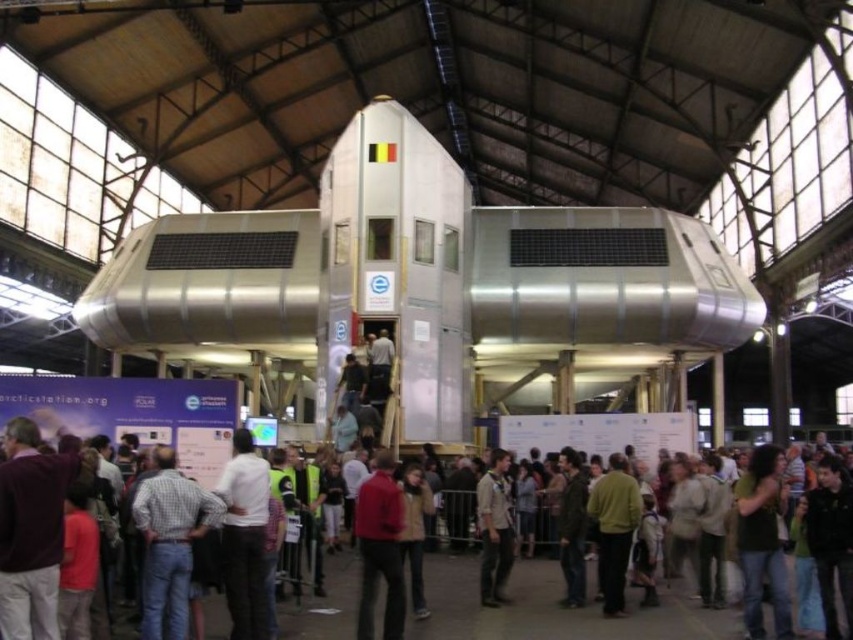
Can you confirm if maroon sweater at lower left is positioned to the left of white matte shirt at center?

Indeed, maroon sweater at lower left is positioned on the left side of white matte shirt at center.

Who is shorter, maroon sweater at lower left or white matte shirt at center?

With less height is maroon sweater at lower left.

Locate an element on the screen. maroon sweater at lower left is located at coordinates (32, 525).

At what (x,y) coordinates should I click in order to perform the action: click on maroon sweater at lower left. Please return your answer as a coordinate pair (x, y). The height and width of the screenshot is (640, 853). Looking at the image, I should click on (32, 525).

What are the coordinates of `checkered shirt jeans at lower left` in the screenshot? It's located at (169, 541).

Who is more distant from viewer, (143, 588) or (227, 547)?

The point (227, 547) is more distant.

In order to click on checkered shirt jeans at lower left in this screenshot , I will do pyautogui.click(x=169, y=541).

Does maroon sweater at lower left appear on the left side of light brown leather jacket at center?

Yes, maroon sweater at lower left is to the left of light brown leather jacket at center.

Can you confirm if maroon sweater at lower left is wider than light brown leather jacket at center?

Yes.

Who is more distant from viewer, [26,493] or [503,481]?

The point [503,481] is more distant.

The width and height of the screenshot is (853, 640). In order to click on maroon sweater at lower left in this screenshot , I will do pyautogui.click(x=32, y=525).